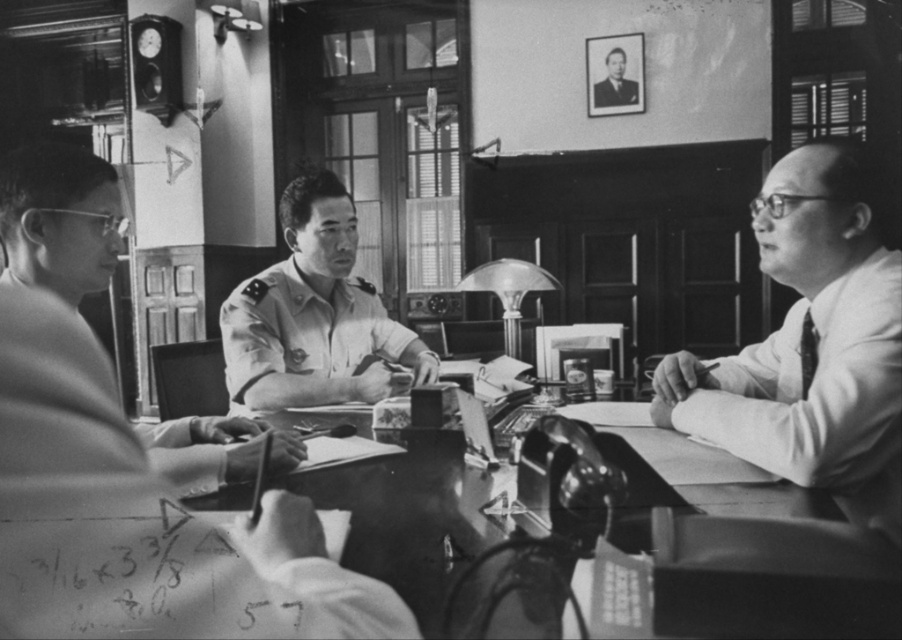
You are standing in the room and want to hand a document to the uniformed officer at center. Based on their position, which direction should you approach from to reach them directly?

The uniformed officer at center is located at point (130, 461), so you should approach from the front to reach them directly.

Based on the scene described, which object is wider? The uniformed officer at center or the uniform at center?

The uniformed officer at center is wider than the uniform at center.